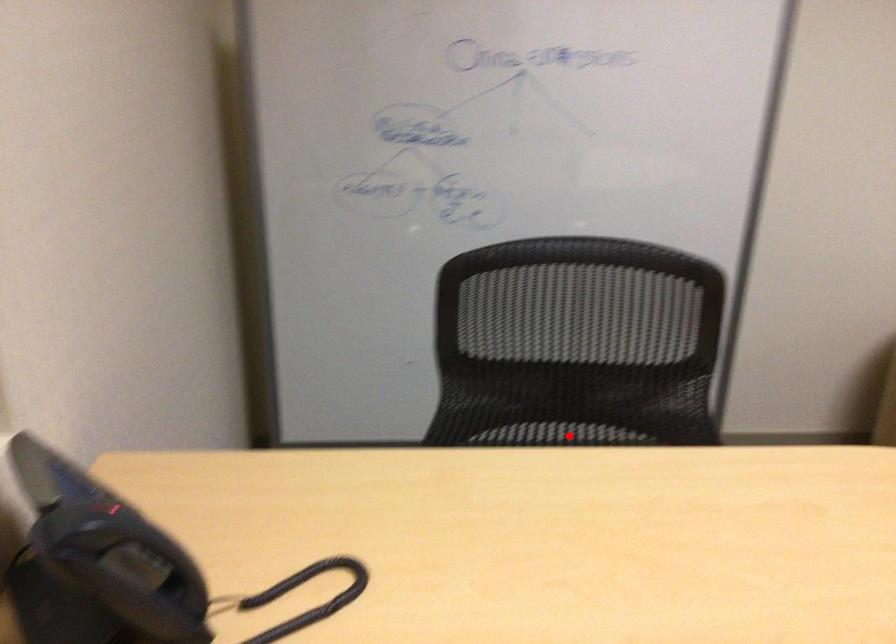
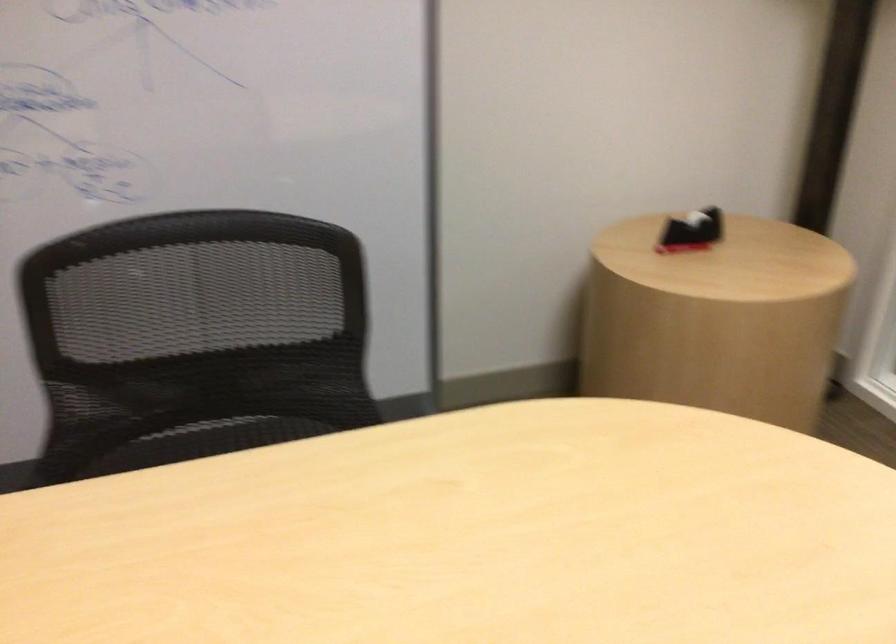
Question: I am providing you with two images of the same scene from different viewpoints. In image1, a red point is highlighted. Considering the same 3D point in image2, which of the following is correct?

Choices:
 (A) It is closer
 (B) It is farther

Answer: (A)